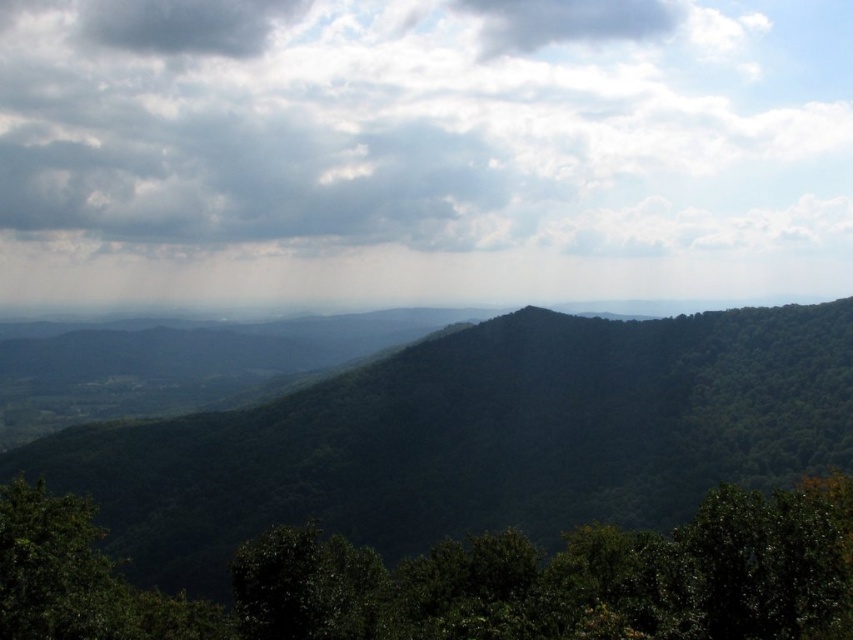
Who is taller, cloudy sky at upper center or green leafy tree at lower center?

Standing taller between the two is cloudy sky at upper center.

Describe the element at coordinates (426, 124) in the screenshot. The image size is (853, 640). I see `cloudy sky at upper center` at that location.

Which is behind, point (132, 221) or point (291, 634)?

Point (132, 221)

You are a GUI agent. You are given a task and a screenshot of the screen. Output one action in this format:
    pyautogui.click(x=<x>, y=<y>)
    Task: Click on the cloudy sky at upper center
    This screenshot has width=853, height=640.
    Given the screenshot: What is the action you would take?
    pyautogui.click(x=426, y=124)

Which is above, cloudy sky at upper center or dark gray cloud at upper left?

dark gray cloud at upper left is higher up.

Is cloudy sky at upper center wider than dark gray cloud at upper left?

Yes, cloudy sky at upper center is wider than dark gray cloud at upper left.

The height and width of the screenshot is (640, 853). I want to click on cloudy sky at upper center, so click(426, 124).

Does green leafy tree at lower center appear on the right side of dark gray cloud at upper left?

Indeed, green leafy tree at lower center is positioned on the right side of dark gray cloud at upper left.

Find the location of a particular element. The image size is (853, 640). green leafy tree at lower center is located at coordinates (457, 579).

Between point (496, 596) and point (242, 40), which one is positioned in front?

Point (496, 596) is more forward.

Where is `green leafy tree at lower center`? The image size is (853, 640). green leafy tree at lower center is located at coordinates (457, 579).